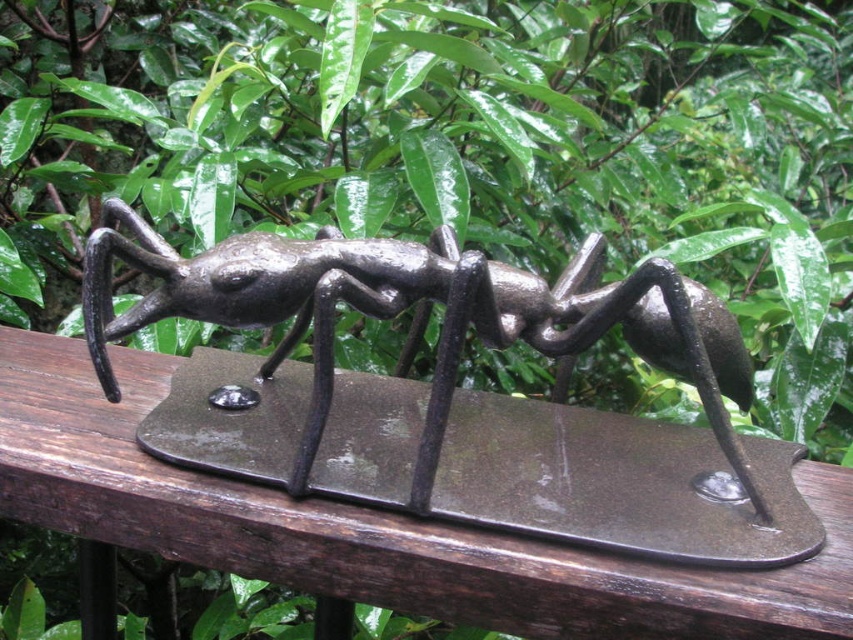
You are standing in front of the metallic sculpture of an ant on the wooden surface. There is a brown wood rail at center. Can you tell me what is located at point (373, 525)?

At point (373, 525) lies the brown wood rail at center.

You are standing in front of the sculpture and want to touch both the brown wood rail at center and the shiny black ant at center. Which object will your hand reach first?

The brown wood rail at center is closer to the viewer than the shiny black ant at center, so you will reach the brown wood rail at center first.